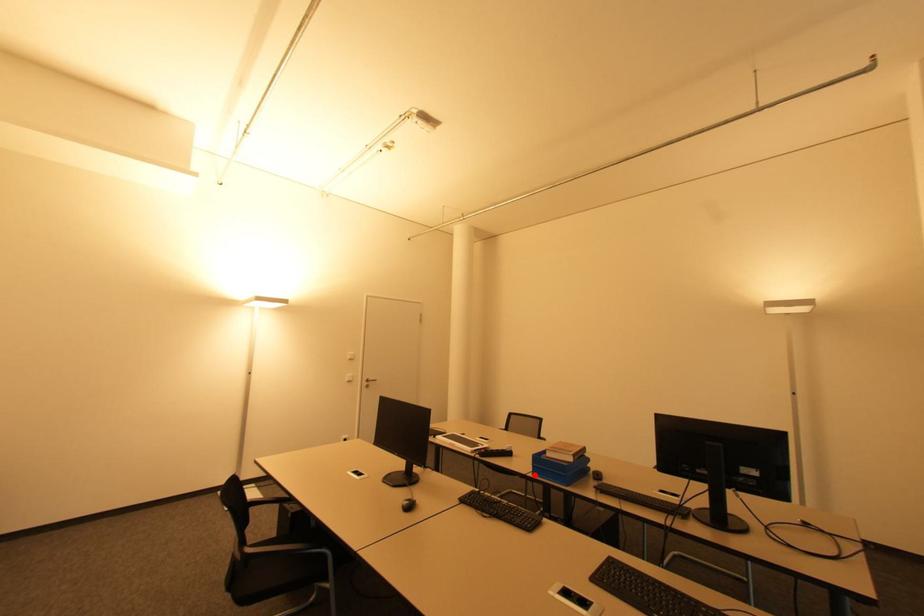
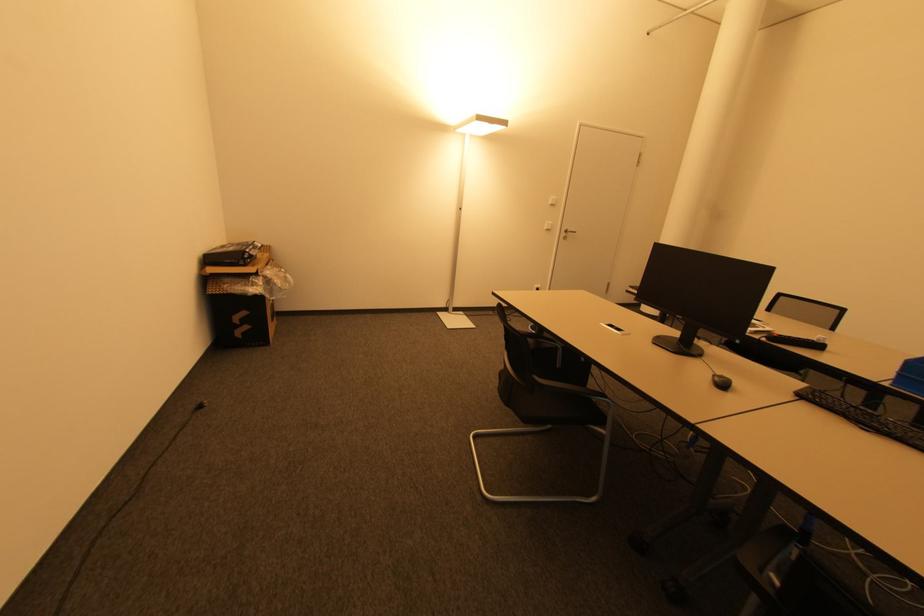
Where in the second image is the point corresponding to the highlighted location from the first image?

(894, 386)